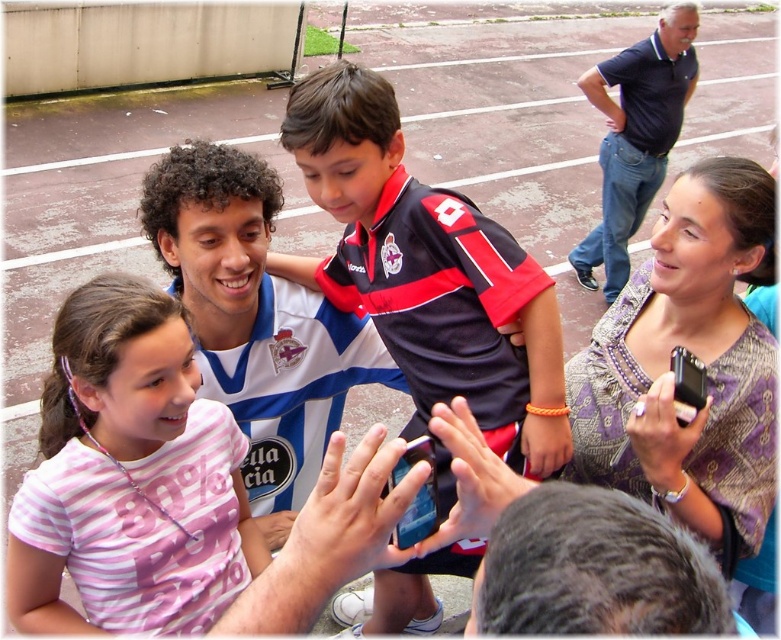
Question: From the image, what is the correct spatial relationship of dark blue jersey at center in relation to blue glossy smartphone at center?

Choices:
 (A) left
 (B) right

Answer: (B)

Question: Which object appears closest to the camera in this image?

Choices:
 (A) pink striped shirt at center
 (B) blue glossy smartphone at center
 (C) dark brown hair at center
 (D) black glossy smartphone at center

Answer: (C)

Question: Does dark blue jersey at center have a smaller size compared to blue glossy smartphone at center?

Choices:
 (A) no
 (B) yes

Answer: (A)

Question: Which object is farther from the camera taking this photo?

Choices:
 (A) pink striped shirt at center
 (B) blue glossy smartphone at center

Answer: (A)

Question: Does dark blue jersey at center have a larger size compared to black glossy smartphone at center?

Choices:
 (A) no
 (B) yes

Answer: (B)

Question: Among these objects, which one is farthest from the camera?

Choices:
 (A) dark blue jersey at center
 (B) black glossy smartphone at center
 (C) pink striped shirt at center

Answer: (A)